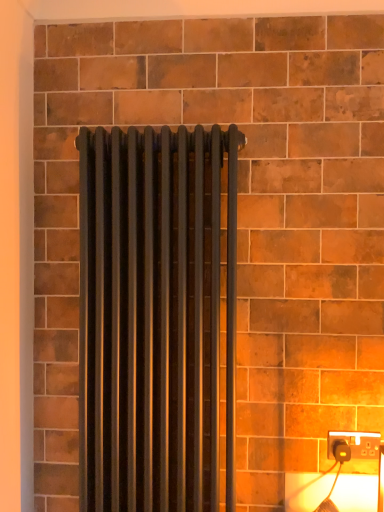
What do you see at coordinates (356, 443) in the screenshot?
I see `black plastic power plug at lower right` at bounding box center [356, 443].

Based on the photo, what is the approximate width of black plastic power plug at lower right?

The width of black plastic power plug at lower right is 1.07 inches.

Where is `black plastic power plug at lower right`? This screenshot has width=384, height=512. black plastic power plug at lower right is located at coordinates (356, 443).

What do you see at coordinates (155, 318) in the screenshot? I see `matte black radiator at center` at bounding box center [155, 318].

What are the coordinates of `matte black radiator at center` in the screenshot? It's located at (155, 318).

At what (x,y) coordinates should I click in order to perform the action: click on black plastic power plug at lower right. Please return your answer as a coordinate pair (x, y). Looking at the image, I should click on (356, 443).

Which is more to the left, black plastic power plug at lower right or matte black radiator at center?

matte black radiator at center is more to the left.

Does black plastic power plug at lower right come behind matte black radiator at center?

That is True.

Which point is more forward, (363, 444) or (109, 168)?

The point (109, 168) is closer to the camera.

From the image's perspective, who appears lower, black plastic power plug at lower right or matte black radiator at center?

black plastic power plug at lower right, from the image's perspective.

From a real-world perspective, is black plastic power plug at lower right positioned under matte black radiator at center based on gravity?

Yes, from a real-world perspective, black plastic power plug at lower right is beneath matte black radiator at center.

Does black plastic power plug at lower right have a lesser width compared to matte black radiator at center?

Yes, black plastic power plug at lower right is thinner than matte black radiator at center.

In the scene shown: Between black plastic power plug at lower right and matte black radiator at center, which one has more height?

Standing taller between the two is matte black radiator at center.

Consider the image. Which of these two, black plastic power plug at lower right or matte black radiator at center, is bigger?

matte black radiator at center.

Is black plastic power plug at lower right not within matte black radiator at center?

Absolutely, black plastic power plug at lower right is external to matte black radiator at center.

Is black plastic power plug at lower right far from matte black radiator at center?

No, black plastic power plug at lower right is not far from matte black radiator at center.

Is black plastic power plug at lower right facing towards matte black radiator at center?

No, black plastic power plug at lower right is not aimed at matte black radiator at center.

Measure the distance between black plastic power plug at lower right and matte black radiator at center.

black plastic power plug at lower right is 24.50 inches away from matte black radiator at center.

The image size is (384, 512). I want to click on radiator in front of the black plastic power plug at lower right, so click(x=155, y=318).

Which is more to the left, matte black radiator at center or black plastic power plug at lower right?

matte black radiator at center.

Is matte black radiator at center closer to the viewer compared to black plastic power plug at lower right?

Yes, it is in front of black plastic power plug at lower right.

Which point is more forward, (207, 320) or (362, 457)?

The point (362, 457) is in front.

From the image's perspective, between matte black radiator at center and black plastic power plug at lower right, who is located below?

black plastic power plug at lower right, from the image's perspective.

From a real-world perspective, is matte black radiator at center physically below black plastic power plug at lower right?

No.

Considering the sizes of matte black radiator at center and black plastic power plug at lower right in the image, is matte black radiator at center wider or thinner than black plastic power plug at lower right?

matte black radiator at center is wider than black plastic power plug at lower right.

Is matte black radiator at center shorter than black plastic power plug at lower right?

No, matte black radiator at center is not shorter than black plastic power plug at lower right.

Considering the sizes of matte black radiator at center and black plastic power plug at lower right in the image, is matte black radiator at center bigger or smaller than black plastic power plug at lower right?

matte black radiator at center is bigger than black plastic power plug at lower right.

Is matte black radiator at center situated inside black plastic power plug at lower right or outside?

matte black radiator at center is not enclosed by black plastic power plug at lower right.

Are matte black radiator at center and black plastic power plug at lower right making contact?

matte black radiator at center is not next to black plastic power plug at lower right, and they're not touching.

Could you tell me if matte black radiator at center is facing black plastic power plug at lower right?

No, matte black radiator at center is not oriented towards black plastic power plug at lower right.

How distant is matte black radiator at center from black plastic power plug at lower right?

matte black radiator at center and black plastic power plug at lower right are 24.50 inches apart from each other.

Locate an element on the screen. The image size is (384, 512). radiator in front of the black plastic power plug at lower right is located at coordinates (155, 318).

I want to click on power plugs and sockets on the right side of matte black radiator at center, so click(356, 443).

At what (x,y) coordinates should I click in order to perform the action: click on radiator above the black plastic power plug at lower right (from a real-world perspective). Please return your answer as a coordinate pair (x, y). The image size is (384, 512). Looking at the image, I should click on (155, 318).